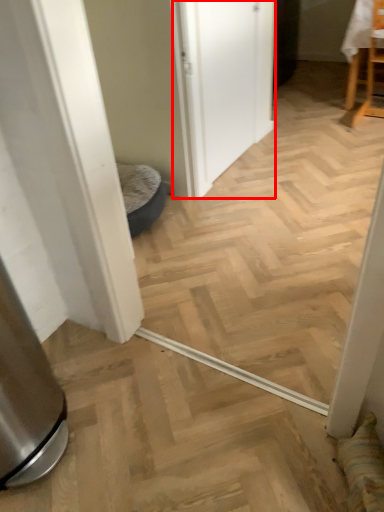
Question: Where is screen door (annotated by the red box) located in relation to chair in the image?

Choices:
 (A) right
 (B) left

Answer: (B)